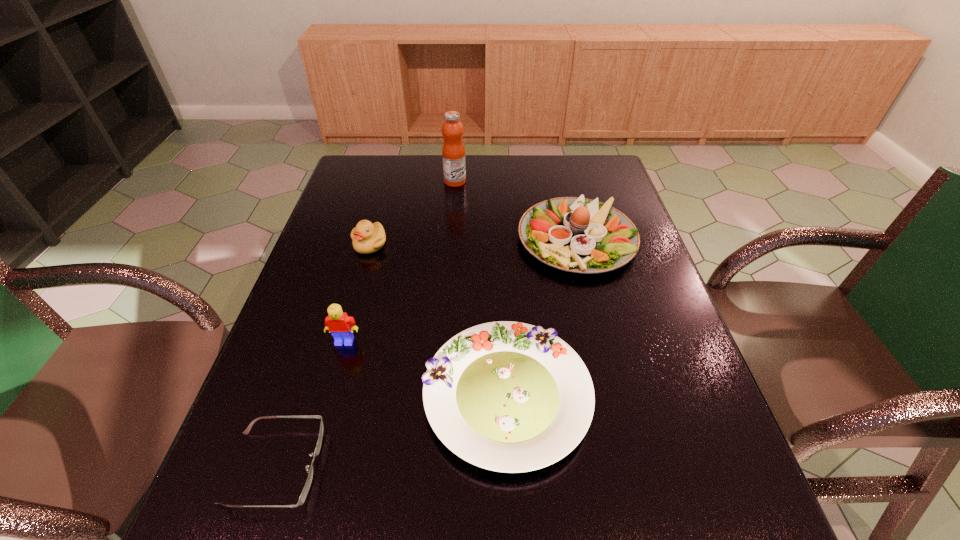
The image size is (960, 540). I want to click on fruit juice, so click(x=453, y=151).

I want to click on the tallest object, so click(x=453, y=151).

Where is `Lego`? Lego is located at coordinates (340, 325).

I want to click on the farther salad plate, so click(580, 235).

Identify the location of the fourth tallest object. (367, 238).

Where is `the fifth tallest object`? This screenshot has height=540, width=960. the fifth tallest object is located at coordinates (505, 396).

Locate an element on the screen. The height and width of the screenshot is (540, 960). the shorter salad plate is located at coordinates (505, 396).

This screenshot has height=540, width=960. I want to click on the shortest object, so click(306, 488).

This screenshot has width=960, height=540. In order to click on vacant space located 0.160m on the front label of the farthest object in this screenshot , I will do click(515, 181).

In order to click on vacant space positioned on the front-facing side of the Lego in this screenshot , I will do `click(331, 389)`.